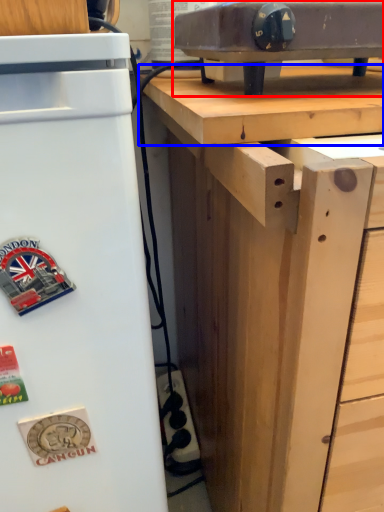
Question: Among these objects, which one is nearest to the camera, appliance (highlighted by a red box) or wood (highlighted by a blue box)?

Choices:
 (A) appliance
 (B) wood

Answer: (B)